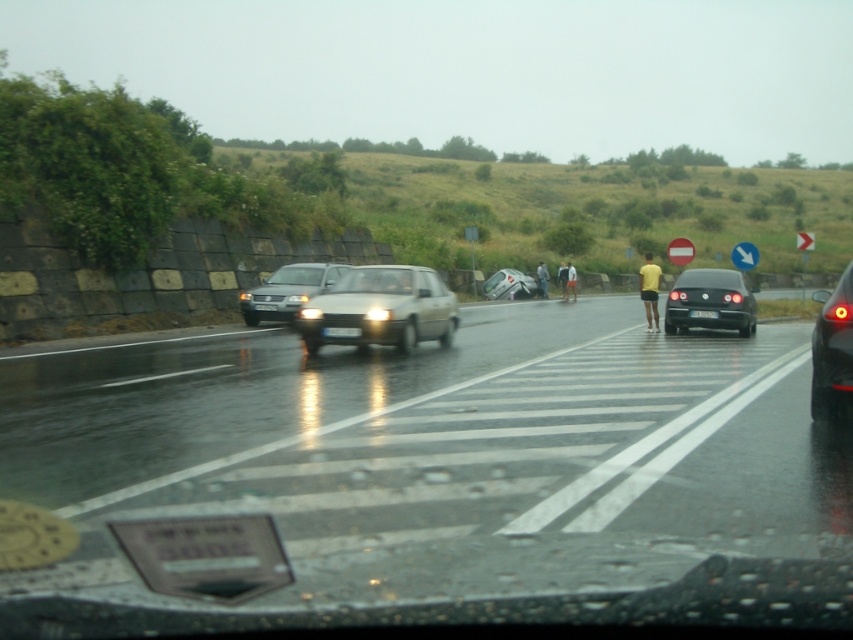
What do you see at coordinates (439, 477) in the screenshot? The width and height of the screenshot is (853, 640). I see `shiny metallic car at center` at bounding box center [439, 477].

The height and width of the screenshot is (640, 853). In order to click on shiny metallic car at center in this screenshot , I will do `click(439, 477)`.

Locate an element on the screen. shiny metallic car at center is located at coordinates pos(439,477).

Who is more distant from viewer, (x=750, y=317) or (x=563, y=280)?

The point (x=563, y=280) is behind.

Can you confirm if shiny black sedan at center is shorter than light blue fabric shorts at center?

A: Incorrect, shiny black sedan at center's height does not fall short of light blue fabric shorts at center's.

What do you see at coordinates (711, 301) in the screenshot?
I see `shiny black sedan at center` at bounding box center [711, 301].

The width and height of the screenshot is (853, 640). What are the coordinates of `shiny black sedan at center` in the screenshot? It's located at click(x=711, y=301).

Who is positioned more to the right, shiny metallic car at center or silver metallic sedan at center?

Positioned to the right is shiny metallic car at center.

Which is in front, point (444, 381) or point (242, 291)?

Point (444, 381)

I want to click on shiny metallic car at center, so click(439, 477).